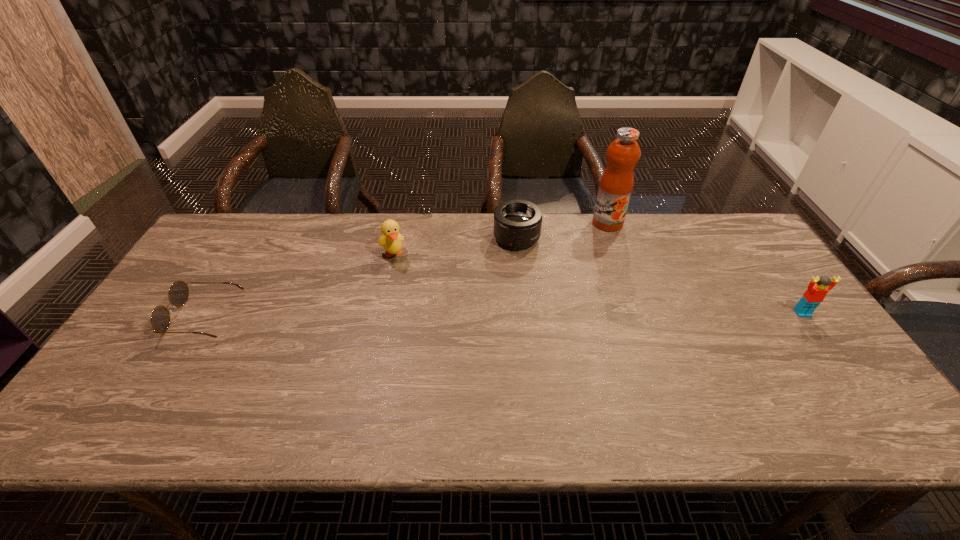
Where is `the leftmost object`? This screenshot has height=540, width=960. the leftmost object is located at coordinates (178, 294).

Where is `sunglasses`? Image resolution: width=960 pixels, height=540 pixels. sunglasses is located at coordinates (178, 294).

Image resolution: width=960 pixels, height=540 pixels. I want to click on the rightmost object, so click(818, 287).

At what (x,y) coordinates should I click in order to perform the action: click on the fourth object from right to left. Please return your answer as a coordinate pair (x, y). Image resolution: width=960 pixels, height=540 pixels. Looking at the image, I should click on (391, 239).

At what (x,y) coordinates should I click in order to perform the action: click on telephoto lens. Please return your answer as a coordinate pair (x, y). This screenshot has width=960, height=540. Looking at the image, I should click on (517, 223).

I want to click on the second shortest object, so pos(517,223).

Locate an element on the screen. This screenshot has width=960, height=540. the tallest object is located at coordinates (616, 184).

This screenshot has width=960, height=540. Identify the location of fruit juice. (616, 184).

You are a GUI agent. You are given a task and a screenshot of the screen. Output one action in this format:
    pyautogui.click(x=<x>, y=<y>)
    Task: Click on the vacant space located 0.170m on the face of the rightmost object
    The height and width of the screenshot is (540, 960).
    Given the screenshot: What is the action you would take?
    pyautogui.click(x=843, y=369)

This screenshot has width=960, height=540. I want to click on vacant space located 0.100m on the front-facing side of the duckling, so click(404, 285).